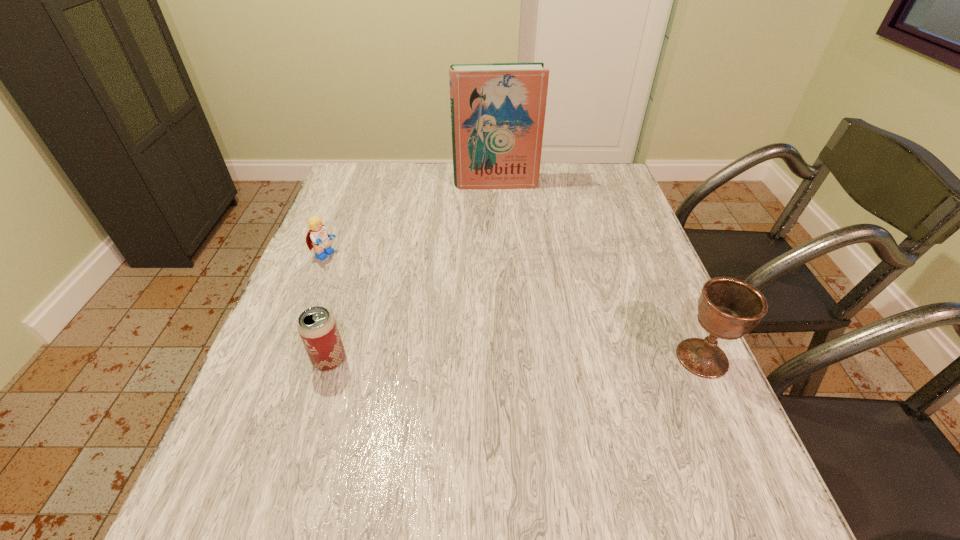
In order to click on vacant region located on the cover of the third object from left to right in this screenshot , I will do [502, 221].

The width and height of the screenshot is (960, 540). Identify the location of vacant space located on the cover of the third object from left to right. (500, 207).

Find the location of `free space located 0.310m on the front-facing side of the second farthest object`. free space located 0.310m on the front-facing side of the second farthest object is located at coordinates (432, 306).

Find the location of a particular element. vacant space located 0.260m on the front-facing side of the second farthest object is located at coordinates (415, 298).

This screenshot has height=540, width=960. In order to click on vacant space located 0.210m on the front-facing side of the second farthest object in this screenshot , I will do `click(397, 291)`.

Locate an element on the screen. Image resolution: width=960 pixels, height=540 pixels. object that is at the far edge is located at coordinates (498, 110).

Locate an element on the screen. beer can positioned at the left edge is located at coordinates (317, 327).

This screenshot has width=960, height=540. Identify the location of Lego positioned at the left edge. (318, 238).

Locate an element on the screen. Image resolution: width=960 pixels, height=540 pixels. object that is at the right edge is located at coordinates tap(728, 308).

Identify the location of vacant region at the far edge of the desktop. The width and height of the screenshot is (960, 540). (399, 178).